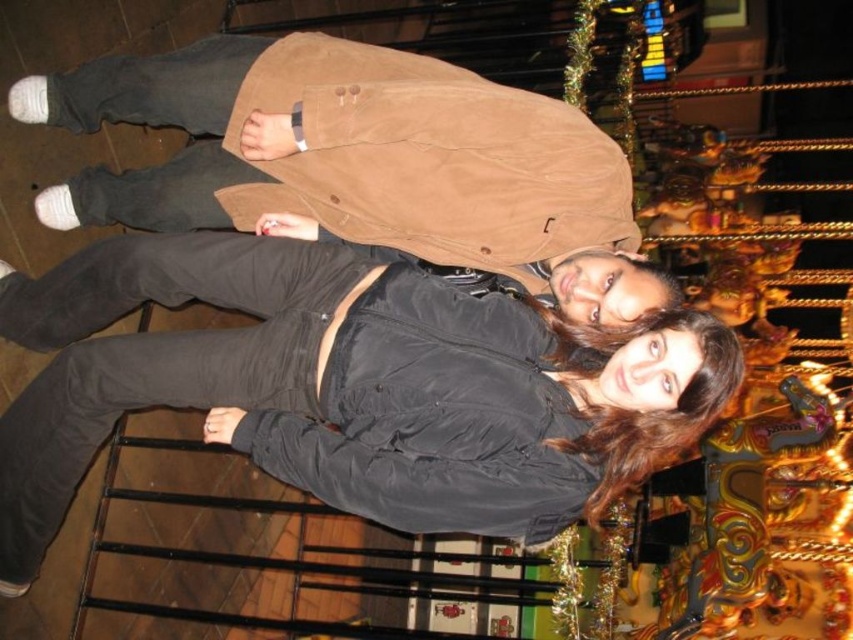
You are a photographer trying to capture both the matte black jacket at center and the black matte jacket at center in a single frame. Which jacket should you focus on to ensure both are in the frame without cropping?

The matte black jacket at center is bigger than the black matte jacket at center, so focusing on the larger one will ensure both are visible in the frame without cropping.